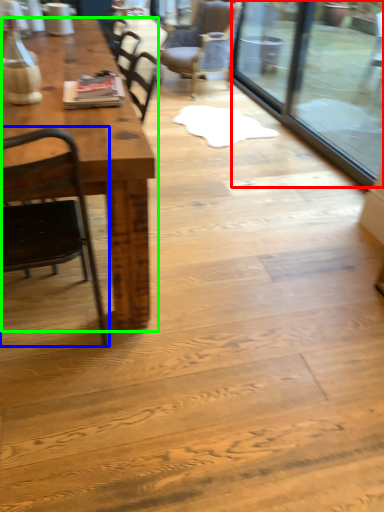
Question: Based on their relative distances, which object is nearer to glass door (highlighted by a red box)? Choose from chair (highlighted by a blue box) and table (highlighted by a green box).

Choices:
 (A) chair
 (B) table

Answer: (B)